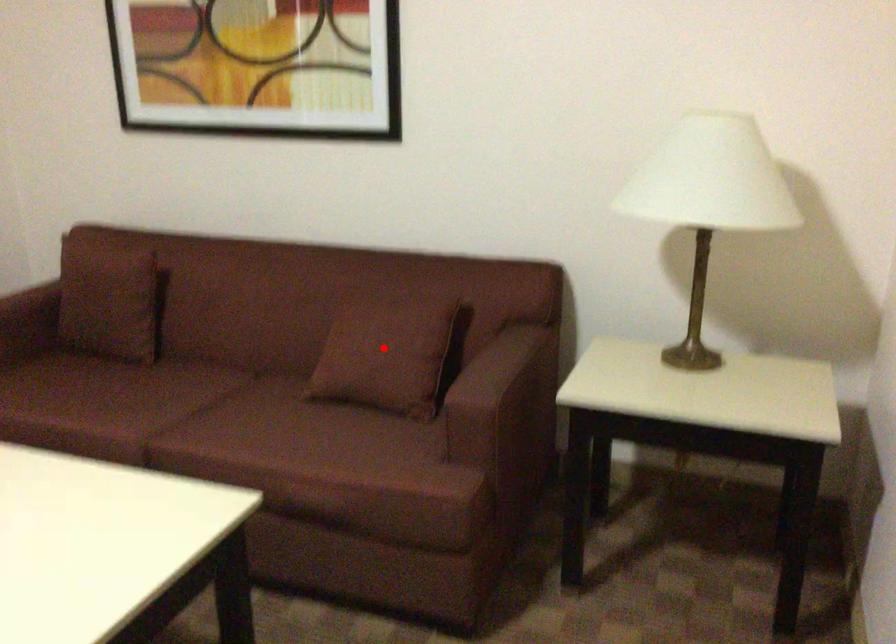
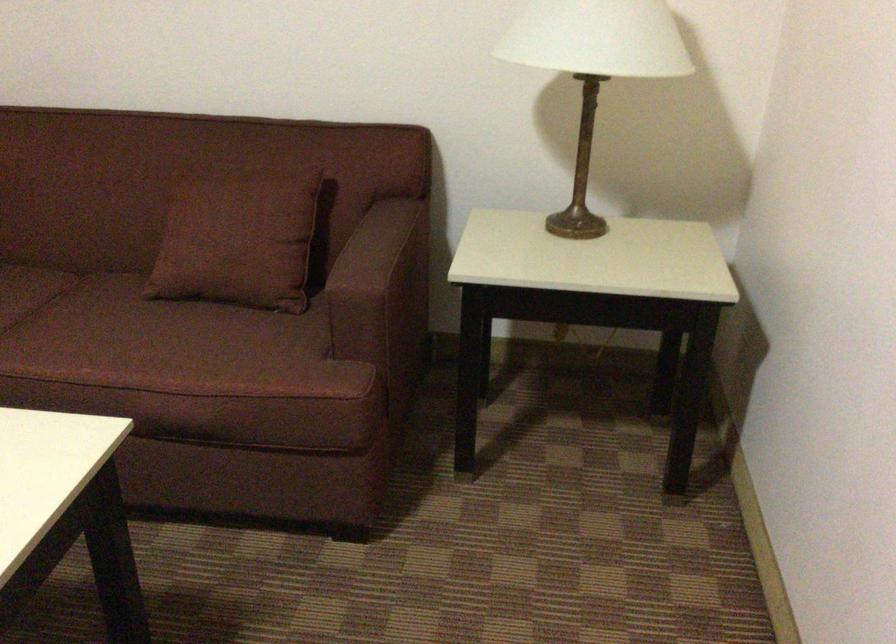
Question: I am providing you with two images of the same scene from different viewpoints. In image1, a red point is highlighted. Considering the same 3D point in image2, which of the following is correct?

Choices:
 (A) It is closer
 (B) It is farther

Answer: (A)